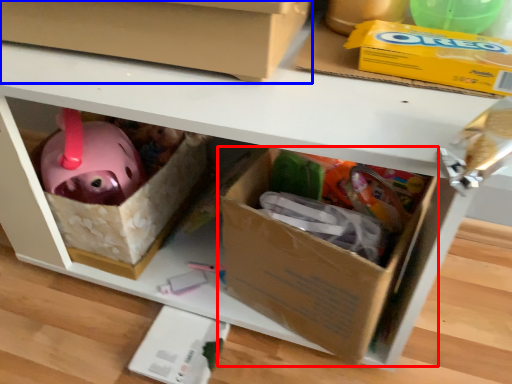
Question: Which of the following is the farthest to the observer, box (highlighted by a red box) or box (highlighted by a blue box)?

Choices:
 (A) box
 (B) box

Answer: (A)